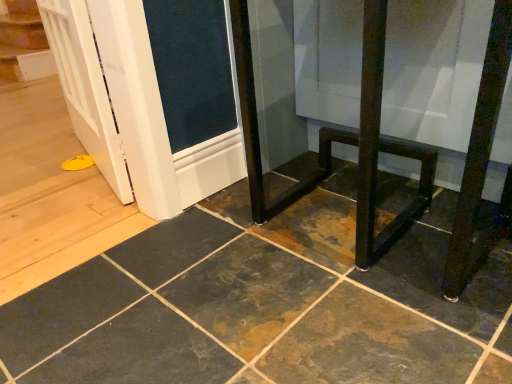
At what (x,y) coordinates should I click in order to perform the action: click on rustic slate tile at center. Please return your answer as a coordinate pair (x, y). Looking at the image, I should click on coord(264,304).

Image resolution: width=512 pixels, height=384 pixels. Describe the element at coordinates (264, 304) in the screenshot. I see `rustic slate tile at center` at that location.

Measure the distance between point (177, 352) and camera.

The distance of point (177, 352) from camera is 31.73 inches.

Image resolution: width=512 pixels, height=384 pixels. Describe the element at coordinates (480, 161) in the screenshot. I see `black metal table at lower right` at that location.

The height and width of the screenshot is (384, 512). I want to click on black metal table at lower right, so click(480, 161).

Image resolution: width=512 pixels, height=384 pixels. In order to click on rustic slate tile at center in this screenshot , I will do `click(264, 304)`.

From the picture: Which is more to the left, rustic slate tile at center or black metal table at lower right?

rustic slate tile at center is more to the left.

Which object is closer to the camera taking this photo, rustic slate tile at center or black metal table at lower right?

rustic slate tile at center is more forward.

Which is more distant, (252, 299) or (247, 71)?

The point (247, 71) is farther from the camera.

From the image's perspective, is rustic slate tile at center positioned above or below black metal table at lower right?

Clearly, from the image's perspective, rustic slate tile at center is below black metal table at lower right.

From a real-world perspective, does rustic slate tile at center sit lower than black metal table at lower right?

Yes, from a real-world perspective, rustic slate tile at center is under black metal table at lower right.

Considering the sizes of rustic slate tile at center and black metal table at lower right in the image, is rustic slate tile at center wider or thinner than black metal table at lower right?

In the image, rustic slate tile at center appears to be wider than black metal table at lower right.

Considering the sizes of objects rustic slate tile at center and black metal table at lower right in the image provided, who is taller, rustic slate tile at center or black metal table at lower right?

black metal table at lower right is taller.

Is rustic slate tile at center bigger or smaller than black metal table at lower right?

Considering their sizes, rustic slate tile at center takes up less space than black metal table at lower right.

Is black metal table at lower right completely or partially inside rustic slate tile at center?

No, rustic slate tile at center does not contain black metal table at lower right.

Would you say rustic slate tile at center is a long distance from black metal table at lower right?

That's not correct — rustic slate tile at center is a little close to black metal table at lower right.

Is rustic slate tile at center positioned with its back to black metal table at lower right?

That's not correct — rustic slate tile at center is not looking away from black metal table at lower right.

From the picture: What's the angular difference between rustic slate tile at center and black metal table at lower right's facing directions?

rustic slate tile at center and black metal table at lower right are facing 90.1 degrees away from each other.

Identify the location of ceramic tile that appears on the left of black metal table at lower right. (264, 304).

Is black metal table at lower right to the left of rustic slate tile at center from the viewer's perspective?

In fact, black metal table at lower right is to the right of rustic slate tile at center.

Considering the positions of objects black metal table at lower right and rustic slate tile at center in the image provided, who is in front, black metal table at lower right or rustic slate tile at center?

rustic slate tile at center is closer to the camera.

Which is in front, point (490, 34) or point (167, 286)?

The point (490, 34) is closer.

From the image's perspective, which is above, black metal table at lower right or rustic slate tile at center?

black metal table at lower right.

In the scene shown: From a real-world perspective, between black metal table at lower right and rustic slate tile at center, who is vertically higher?

black metal table at lower right is physically above.

Can you confirm if black metal table at lower right is thinner than rustic slate tile at center?

Yes.

Considering the relative sizes of black metal table at lower right and rustic slate tile at center in the image provided, is black metal table at lower right taller than rustic slate tile at center?

Correct, black metal table at lower right is much taller as rustic slate tile at center.

Who is smaller, black metal table at lower right or rustic slate tile at center?

Smaller between the two is rustic slate tile at center.

Is rustic slate tile at center surrounded by black metal table at lower right?

Actually, rustic slate tile at center is outside black metal table at lower right.

Does black metal table at lower right touch rustic slate tile at center?

black metal table at lower right and rustic slate tile at center are clearly separated.

Is rustic slate tile at center at the back of black metal table at lower right?

That's not correct — black metal table at lower right is not looking away from rustic slate tile at center.

Measure the distance from black metal table at lower right to rustic slate tile at center.

black metal table at lower right is 11.16 inches away from rustic slate tile at center.

What are the coordinates of `furniture above the rustic slate tile at center (from a real-world perspective)` in the screenshot? It's located at coord(480,161).

Find the location of a particular element. This screenshot has width=512, height=384. ceramic tile that appears below the black metal table at lower right (from a real-world perspective) is located at coordinates (264, 304).

This screenshot has width=512, height=384. Find the location of `ceramic tile on the left of the black metal table at lower right`. ceramic tile on the left of the black metal table at lower right is located at coordinates (264, 304).